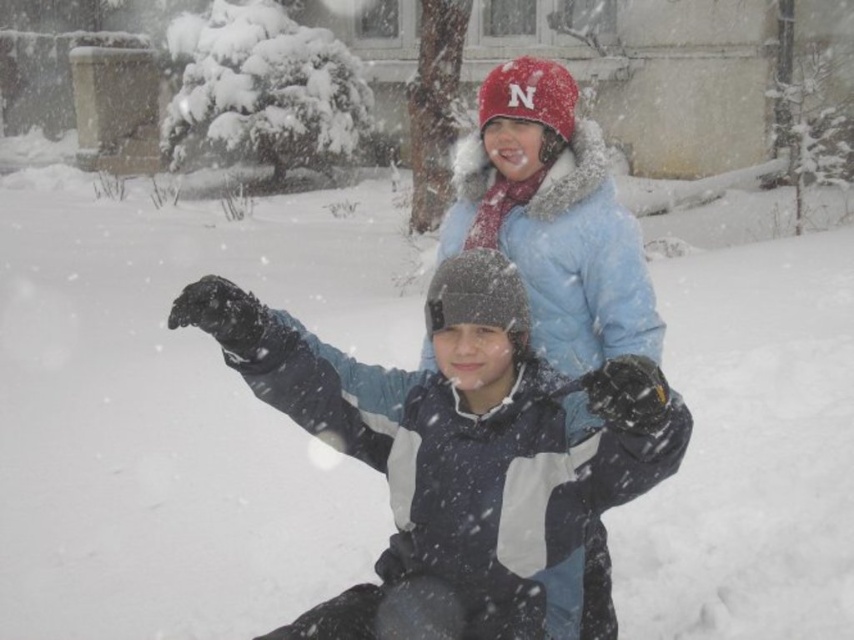
Is point (202, 308) less distant than point (544, 298)?

Yes, point (202, 308) is closer to viewer.

What are the coordinates of `matte black jacket at center` in the screenshot? It's located at (457, 442).

The width and height of the screenshot is (854, 640). What do you see at coordinates (457, 442) in the screenshot?
I see `matte black jacket at center` at bounding box center [457, 442].

You are a GUI agent. You are given a task and a screenshot of the screen. Output one action in this format:
    pyautogui.click(x=<x>, y=<y>)
    Task: Click on the matte black jacket at center
    
    Given the screenshot: What is the action you would take?
    pyautogui.click(x=457, y=442)